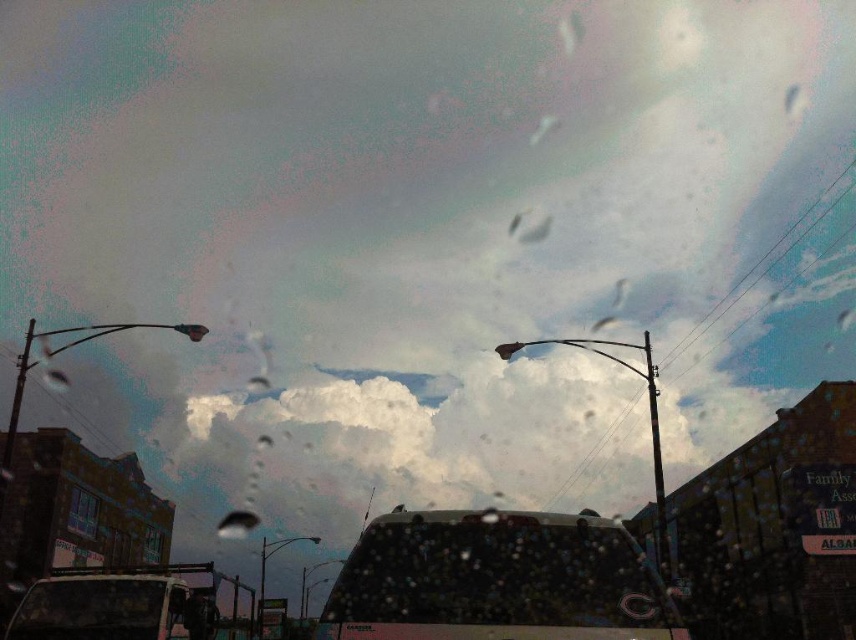
Is dark matte car at center below matte black van at lower left?

Incorrect, dark matte car at center is not positioned below matte black van at lower left.

Can you confirm if dark matte car at center is positioned to the left of matte black van at lower left?

Incorrect, dark matte car at center is not on the left side of matte black van at lower left.

Is point (498, 579) positioned after point (193, 608)?

No, it is in front of (193, 608).

Where is `dark matte car at center`? dark matte car at center is located at coordinates (497, 579).